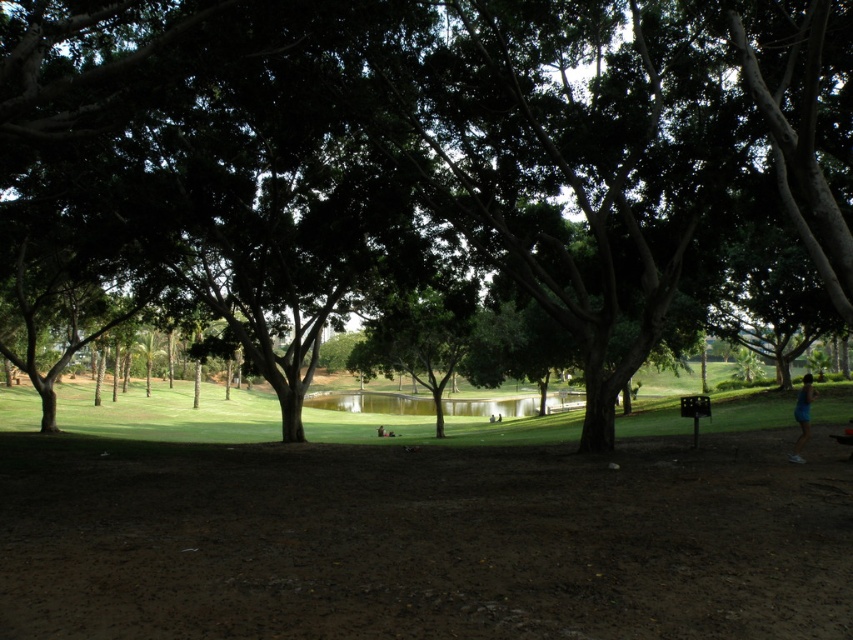
Question: Does green leafy tree at center appear over green smooth water at center?

Choices:
 (A) yes
 (B) no

Answer: (A)

Question: Can you confirm if green smooth water at center is positioned to the right of blue fabric shorts at lower right?

Choices:
 (A) no
 (B) yes

Answer: (A)

Question: Which of the following is the closest to the observer?

Choices:
 (A) green smooth water at center
 (B) blue fabric shorts at lower right

Answer: (B)

Question: Does green smooth water at center appear over blue fabric shorts at lower right?

Choices:
 (A) no
 (B) yes

Answer: (A)

Question: Which is nearer to the blue fabric shorts at lower right?

Choices:
 (A) green smooth water at center
 (B) green leafy tree at center

Answer: (B)

Question: Among these objects, which one is farthest from the camera?

Choices:
 (A) blue fabric shorts at lower right
 (B) green leafy tree at center

Answer: (A)